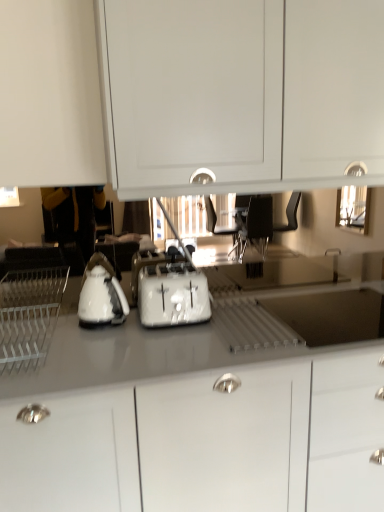
The image size is (384, 512). Identify the location of white glossy electric kettle at center. (101, 294).

What do you see at coordinates (29, 315) in the screenshot? I see `white plastic dish rack at left` at bounding box center [29, 315].

Image resolution: width=384 pixels, height=512 pixels. Identify the location of white plastic toaster at center. (172, 295).

Considering the relative sizes of white glossy cabinet at center, acting as the 2th cabinetry starting from the top, and white glossy electric kettle at center in the image provided, is white glossy cabinet at center, acting as the 2th cabinetry starting from the top, smaller than white glossy electric kettle at center?

Incorrect, white glossy cabinet at center, acting as the 2th cabinetry starting from the top, is not smaller in size than white glossy electric kettle at center.

Does white glossy cabinet at center, acting as the 2th cabinetry starting from the top, have a lesser height compared to white glossy electric kettle at center?

Incorrect, the height of white glossy cabinet at center, acting as the 2th cabinetry starting from the top, does not fall short of that of white glossy electric kettle at center.

In the image, is white glossy cabinet at center, acting as the 2th cabinetry starting from the top, positioned in front of or behind white glossy electric kettle at center?

In the image, white glossy cabinet at center, acting as the 2th cabinetry starting from the top, appears in front of white glossy electric kettle at center.

Is white glossy electric kettle at center aimed at white plastic dish rack at left?

No, white glossy electric kettle at center is not oriented towards white plastic dish rack at left.

Would you say white glossy electric kettle at center is outside white plastic dish rack at left?

Yes, white glossy electric kettle at center is outside of white plastic dish rack at left.

From a real-world perspective, which is physically below, white glossy electric kettle at center or white plastic dish rack at left?

white plastic dish rack at left.

In the image, is white plastic toaster at center on the left side or the right side of white plastic dish rack at left?

Clearly, white plastic toaster at center is on the right of white plastic dish rack at left in the image.

Is white plastic toaster at center placed right next to white plastic dish rack at left?

No, white plastic toaster at center is not in contact with white plastic dish rack at left.

Between white plastic toaster at center and white plastic dish rack at left, which one has larger width?

With larger width is white plastic dish rack at left.

Where is `toaster in front of the white glossy electric kettle at center`? Image resolution: width=384 pixels, height=512 pixels. toaster in front of the white glossy electric kettle at center is located at coordinates (172, 295).

Does point (161, 308) appear closer or farther from the camera than point (92, 322)?

Point (161, 308) is closer to the camera than point (92, 322).

From their relative heights in the image, would you say white plastic toaster at center is taller or shorter than white glossy electric kettle at center?

In the image, white plastic toaster at center appears to be shorter than white glossy electric kettle at center.

From a real-world perspective, who is located lower, white plastic toaster at center or white glossy electric kettle at center?

white plastic toaster at center, from a real-world perspective.

Can you see white glossy cabinet at center, acting as the 2th cabinetry starting from the top, touching white plastic toaster at center?

white glossy cabinet at center, acting as the 2th cabinetry starting from the top, is not next to white plastic toaster at center, and they're not touching.

Which is nearer, (178, 410) or (195, 290)?

Positioned in front is point (178, 410).

Locate an element on the screen. This screenshot has width=384, height=512. toaster located above the white glossy cabinet at center, acting as the 2th cabinetry starting from the top (from the image's perspective) is located at coordinates (172, 295).

Is white glossy cabinet at center, acting as the 2th cabinetry starting from the top, positioned behind white plastic toaster at center?

No, white glossy cabinet at center, acting as the 2th cabinetry starting from the top, is closer to the camera.

Could you tell me if white glossy electric kettle at center is facing white plastic toaster at center?

No, white glossy electric kettle at center is not turned towards white plastic toaster at center.

How many degrees apart are the facing directions of white glossy electric kettle at center and white plastic toaster at center?

The angle between the facing direction of white glossy electric kettle at center and the facing direction of white plastic toaster at center is 1.24 degrees.

Is white glossy electric kettle at center located outside white plastic toaster at center?

Yes, white glossy electric kettle at center is not within white plastic toaster at center.

Can you confirm if white matte cabinet at upper center, which appears as the 2th cabinetry when ordered from the bottom, is positioned to the left of white plastic toaster at center?

No.

Measure the distance from white matte cabinet at upper center, which appears as the 2th cabinetry when ordered from the bottom, to white plastic toaster at center.

24.56 inches.

At what (x,y) coordinates should I click in order to perform the action: click on toaster that is on the left side of white matte cabinet at upper center, which appears as the 2th cabinetry when ordered from the bottom. Please return your answer as a coordinate pair (x, y). The width and height of the screenshot is (384, 512). Looking at the image, I should click on (172, 295).

Consider the image. Which is further, (373, 67) or (150, 263)?

The point (150, 263) is farther from the camera.

From the white glossy electric kettle at center, count 2nd cabinetrys forward and point to it. Please provide its 2D coordinates.

[(207, 442)]

You are a GUI agent. You are given a task and a screenshot of the screen. Output one action in this format:
    pyautogui.click(x=<x>, y=<y>)
    Task: Click on the kitchen appliance on the right of white plastic dish rack at left
    
    Given the screenshot: What is the action you would take?
    pyautogui.click(x=101, y=294)

Which object lies nearer to the anchor point white glossy cabinet at center, acting as the 2th cabinetry starting from the top, white glossy electric kettle at center or white plastic toaster at center?

The object closer to white glossy cabinet at center, acting as the 2th cabinetry starting from the top, is white plastic toaster at center.

Consider the image. Considering their positions, is white plastic dish rack at left positioned closer to white glossy cabinet at center, acting as the 2th cabinetry starting from the top, than white glossy electric kettle at center?

white glossy electric kettle at center is closer to white glossy cabinet at center, acting as the 2th cabinetry starting from the top.

Looking at the image, which one is located further to white glossy electric kettle at center, white plastic toaster at center or white glossy cabinet at center, acting as the 2th cabinetry starting from the top?

Among the two, white glossy cabinet at center, acting as the 2th cabinetry starting from the top, is located further to white glossy electric kettle at center.

Looking at the image, which one is located closer to white plastic toaster at center, white glossy electric kettle at center or white matte cabinet at upper center, which appears as the 2th cabinetry when ordered from the bottom?

white glossy electric kettle at center is positioned closer to the anchor white plastic toaster at center.

Estimate the real-world distances between objects in this image. Which object is closer to white plastic dish rack at left, white glossy cabinet at center, acting as the 2th cabinetry starting from the top, or white matte cabinet at upper center, which appears as the 2th cabinetry when ordered from the bottom?

A: white glossy cabinet at center, acting as the 2th cabinetry starting from the top.

From the image, which object appears to be nearer to white glossy cabinet at center, which ranks as the first cabinetry in bottom-to-top order, white glossy electric kettle at center or white plastic dish rack at left?

white glossy electric kettle at center lies closer to white glossy cabinet at center, which ranks as the first cabinetry in bottom-to-top order, than the other object.

Looking at the image, which one is located further to white matte cabinet at upper center, which is the first cabinetry from top to bottom, white glossy electric kettle at center or white plastic dish rack at left?

white plastic dish rack at left is positioned further to the anchor white matte cabinet at upper center, which is the first cabinetry from top to bottom.

Based on their spatial positions, is white matte cabinet at upper center, which is the first cabinetry from top to bottom, or white glossy electric kettle at center further from white plastic dish rack at left?

Among the two, white matte cabinet at upper center, which is the first cabinetry from top to bottom, is located further to white plastic dish rack at left.

Where is `kitchen appliance situated between white plastic dish rack at left and white plastic toaster at center from left to right`? The width and height of the screenshot is (384, 512). kitchen appliance situated between white plastic dish rack at left and white plastic toaster at center from left to right is located at coordinates tap(101, 294).

Find the location of a particular element. This screenshot has width=384, height=512. kitchen appliance between white plastic toaster at center and white glossy cabinet at center, acting as the 2th cabinetry starting from the top, in the up-down direction is located at coordinates (101, 294).

The width and height of the screenshot is (384, 512). What are the coordinates of `home appliance between white matte cabinet at upper center, which is the first cabinetry from top to bottom, and white glossy cabinet at center, acting as the 2th cabinetry starting from the top, vertically` in the screenshot? It's located at (29, 315).

Locate an element on the screen. This screenshot has height=512, width=384. kitchen appliance between white matte cabinet at upper center, which appears as the 2th cabinetry when ordered from the bottom, and white plastic dish rack at left from top to bottom is located at coordinates (101, 294).